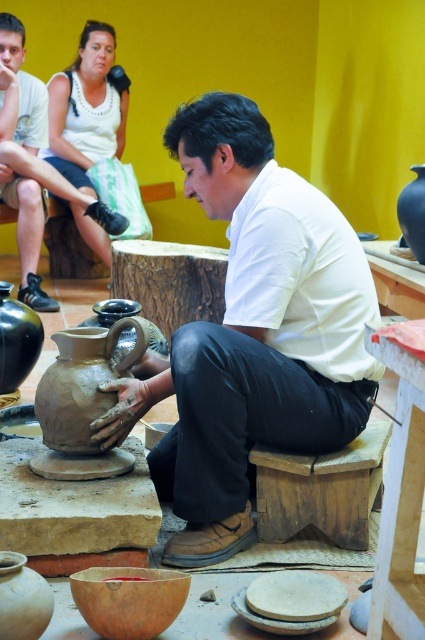
Question: Does matte clay pot at lower left have a smaller size compared to matte black vase at left?

Choices:
 (A) no
 (B) yes

Answer: (B)

Question: Among these points, which one is farthest from the camera?

Choices:
 (A) (359, 524)
 (B) (2, 316)
 (C) (73, 452)
 (D) (416, 195)

Answer: (D)

Question: Which object is positioned closest to the matte clay potter at center?

Choices:
 (A) matte black vase at upper right
 (B) wooden stool at center
 (C) matte clay pitcher at center

Answer: (C)

Question: Which of the following is the closest to the observer?

Choices:
 (A) (76, 374)
 (B) (286, 486)

Answer: (A)

Question: Does wooden stool at center have a lesser width compared to matte clay pot at center?

Choices:
 (A) no
 (B) yes

Answer: (B)

Question: Can you confirm if matte clay pot at center is wider than matte black vase at left?

Choices:
 (A) yes
 (B) no

Answer: (A)